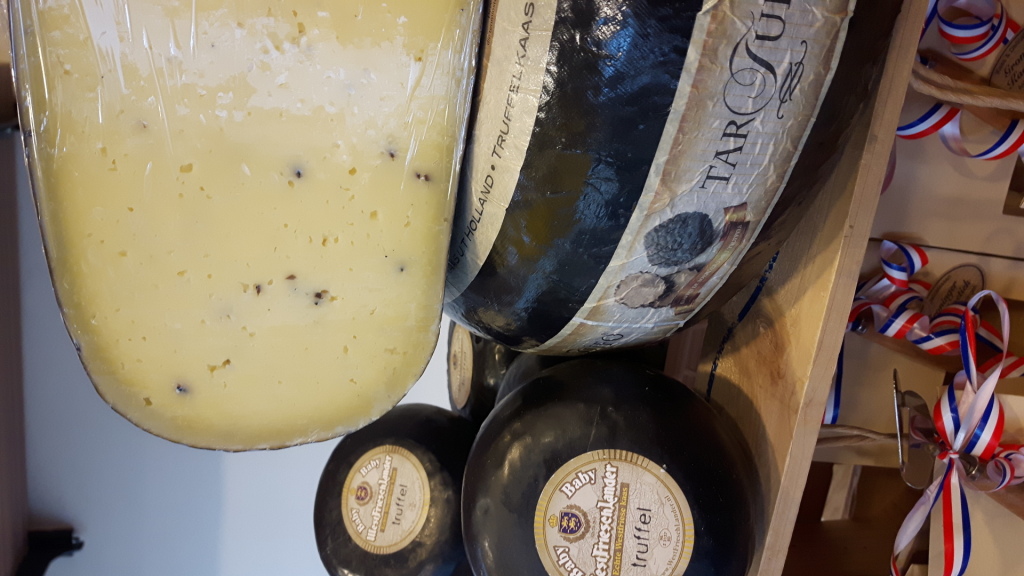
Identify the location of cords. This screenshot has height=576, width=1024. (258, 478), (246, 477).